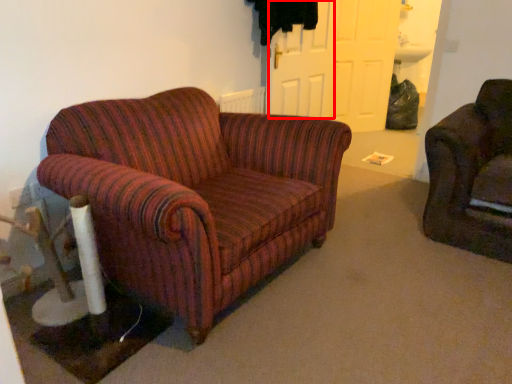
Question: From the image's perspective, what is the correct spatial positioning of door (annotated by the red box) in reference to door?

Choices:
 (A) below
 (B) above

Answer: (A)